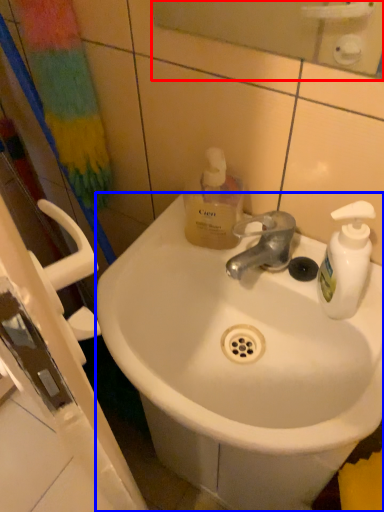
Question: Which point is further to the camera, mirror (highlighted by a red box) or sink (highlighted by a blue box)?

Choices:
 (A) mirror
 (B) sink

Answer: (B)